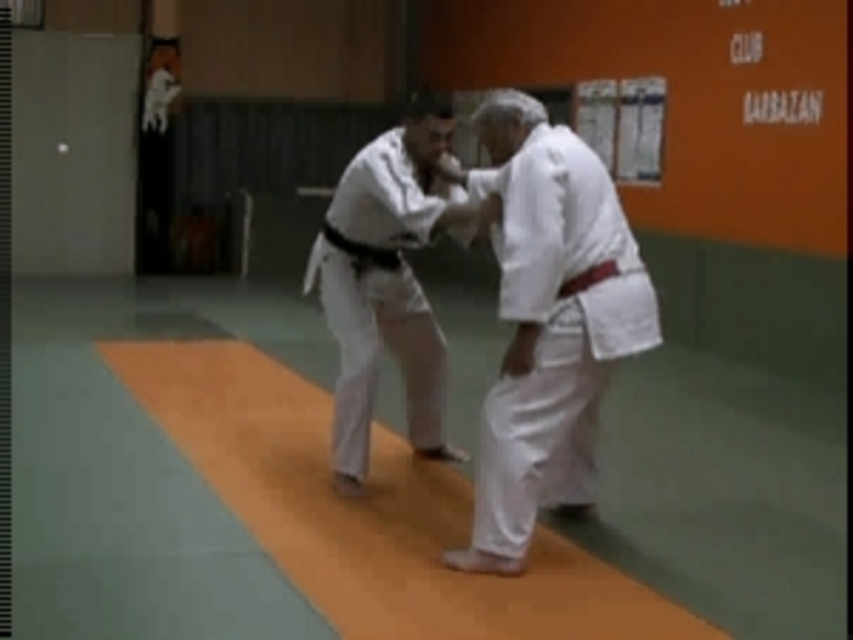
Based on the photo, you are a judo instructor observing two students wearing white cloth kimono at center and white fabric kimono at center. Which kimono is more appropriate for a higher ranked student?

The white cloth kimono at center is more appropriate for a higher ranked student because it is larger in size than the white fabric kimono at center.

You are a photographer standing in the gymnasium. You need to capture a photo of both the white cloth kimono at center and the white fabric kimono at center. Which kimono should you focus on first to ensure it appears larger in the photo?

The white cloth kimono at center is much taller than the white fabric kimono at center, so you should focus on the white cloth kimono at center first to ensure it appears larger in the photo.